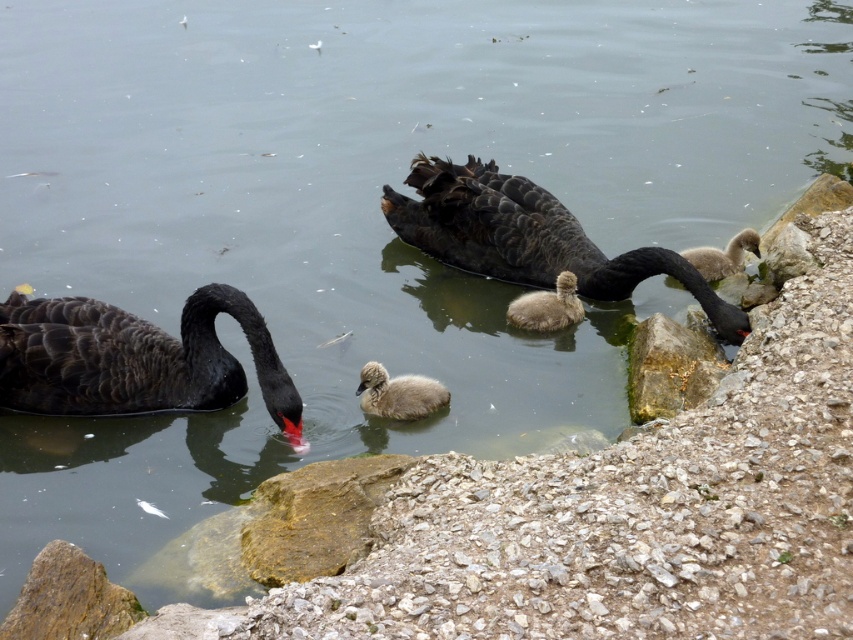
Question: Can you confirm if black glossy swan at center is smaller than brown downy duckling at center?

Choices:
 (A) yes
 (B) no

Answer: (B)

Question: Which object is the farthest from the rusty metallic rock at right?

Choices:
 (A) brown downy duckling at center
 (B) black glossy swan at center
 (C) fluffy gray cygnet at right
 (D) soft gray downy duckling at center

Answer: (A)

Question: Is black glossy swan at center below fluffy gray cygnet at right?

Choices:
 (A) yes
 (B) no

Answer: (B)

Question: Which of the following is the farthest from the observer?

Choices:
 (A) 418,392
 (B) 668,403
 (C) 576,285

Answer: (C)

Question: Estimate the real-world distances between objects in this image. Which object is closer to the brown downy duckling at center?

Choices:
 (A) fluffy gray cygnet at right
 (B) soft gray downy duckling at center
 (C) black glossy swan at center
 (D) rusty metallic rock at right

Answer: (B)

Question: Does brown downy duckling at center appear on the left side of fluffy gray cygnet at right?

Choices:
 (A) yes
 (B) no

Answer: (A)